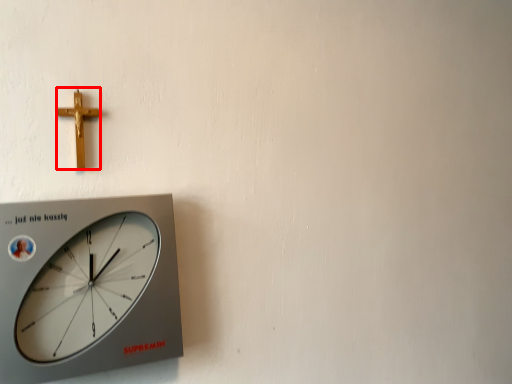
Question: From the image's perspective, what is the correct spatial relationship of crucifix (annotated by the red box) in relation to wall clock?

Choices:
 (A) below
 (B) above

Answer: (B)